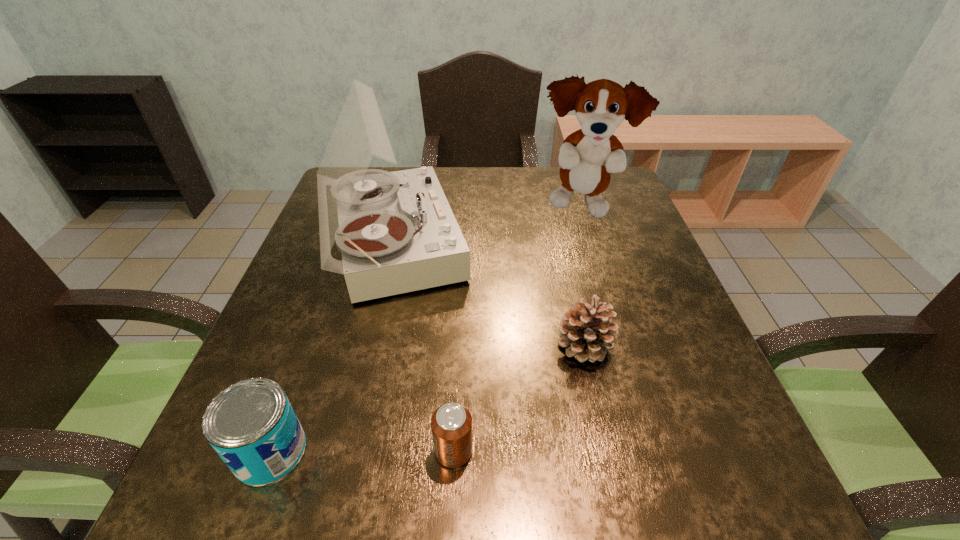
Locate an element on the screen. This screenshot has height=540, width=960. free space located on the left of the right can is located at coordinates (315, 450).

Identify the location of puppy that is positioned at the far edge. (587, 156).

Where is `record player situated at the far edge`? record player situated at the far edge is located at coordinates (396, 231).

Where is `record player located at the left edge`? Image resolution: width=960 pixels, height=540 pixels. record player located at the left edge is located at coordinates (396, 231).

You are a GUI agent. You are given a task and a screenshot of the screen. Output one action in this format:
    pyautogui.click(x=<x>, y=<y>)
    Task: Click on the can positioned at the left edge
    
    Given the screenshot: What is the action you would take?
    pyautogui.click(x=252, y=426)

Where is `object that is at the right edge`? This screenshot has width=960, height=540. object that is at the right edge is located at coordinates (587, 156).

Locate an element on the screen. The image size is (960, 540). object that is at the far left corner is located at coordinates (396, 231).

Identify the location of object located at the near left corner. (252, 426).

This screenshot has height=540, width=960. Identify the location of object that is at the far right corner. (587, 156).

The width and height of the screenshot is (960, 540). In the image, there is a desktop. Identify the location of vacant space at the far edge. (546, 200).